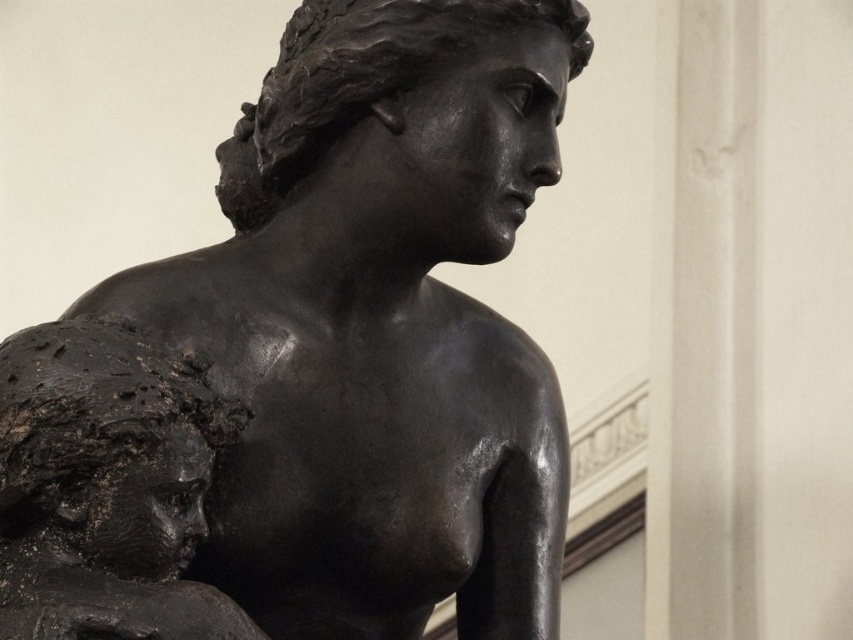
Does point (160, 474) come closer to viewer compared to point (141, 452)?

That is False.

Looking at this image, does shiny bronze statue at center have a smaller size compared to matte black bust at left?

Actually, shiny bronze statue at center might be larger than matte black bust at left.

The image size is (853, 640). In order to click on shiny bronze statue at center in this screenshot , I will do `click(312, 364)`.